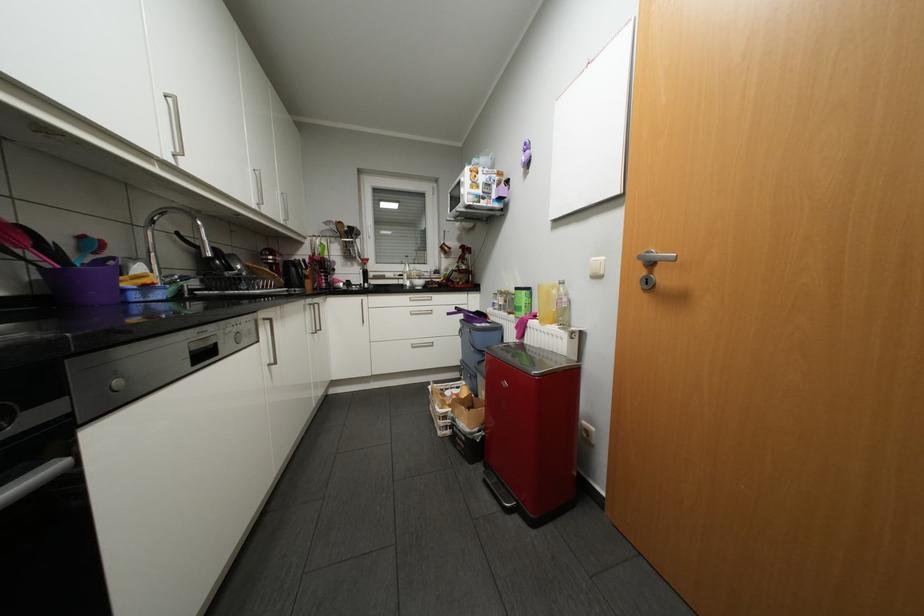
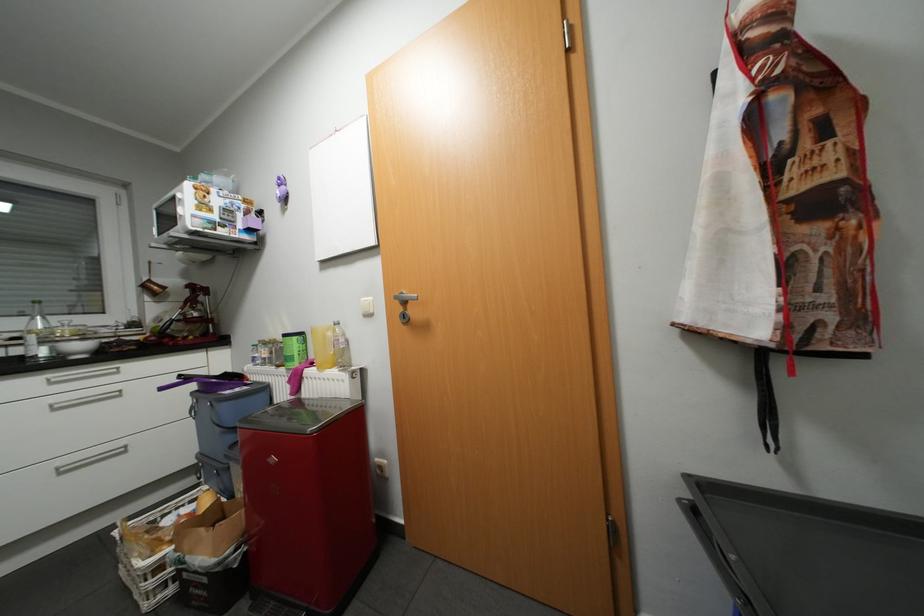
Where in the second image is the point corresponding to (x=409, y=284) from the first image?

(30, 357)